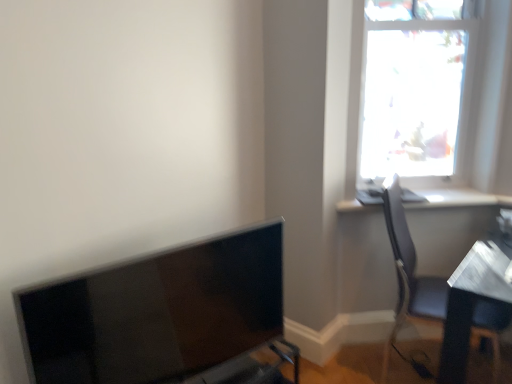
Where is `vacant point above white glossy window sill at upper right (from a real-world perspective)`? The image size is (512, 384). vacant point above white glossy window sill at upper right (from a real-world perspective) is located at coordinates (392, 192).